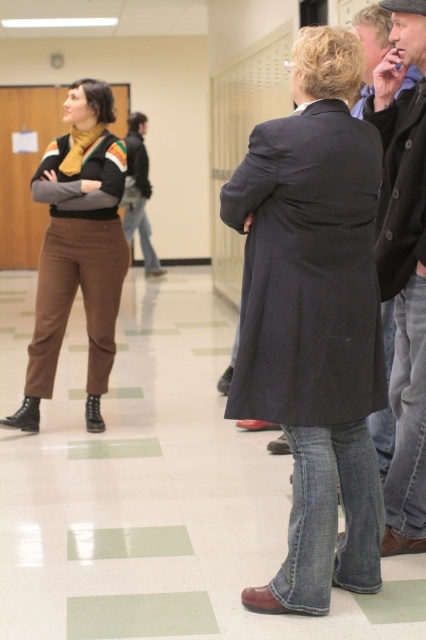
Question: Observing the image, what is the correct spatial positioning of matte brown pants at left in reference to dark gray jacket at center?

Choices:
 (A) left
 (B) right

Answer: (B)

Question: Does dark gray wool coat at center appear under dark gray jacket at center?

Choices:
 (A) yes
 (B) no

Answer: (A)

Question: Which point is closer to the camera?

Choices:
 (A) matte brown pants at left
 (B) dark gray jacket at center
 (C) dark brown leather jacket at right

Answer: (C)

Question: From the image, what is the correct spatial relationship of dark gray wool coat at center in relation to dark brown leather jacket at right?

Choices:
 (A) below
 (B) above

Answer: (A)

Question: Among these points, which one is nearest to the camera?

Choices:
 (A) (296, 451)
 (B) (131, 196)
 (C) (51, 292)

Answer: (A)

Question: Which of these objects is positioned closest to the dark gray jacket at center?

Choices:
 (A) dark brown leather jacket at right
 (B) dark gray wool coat at center
 (C) matte brown pants at left

Answer: (C)